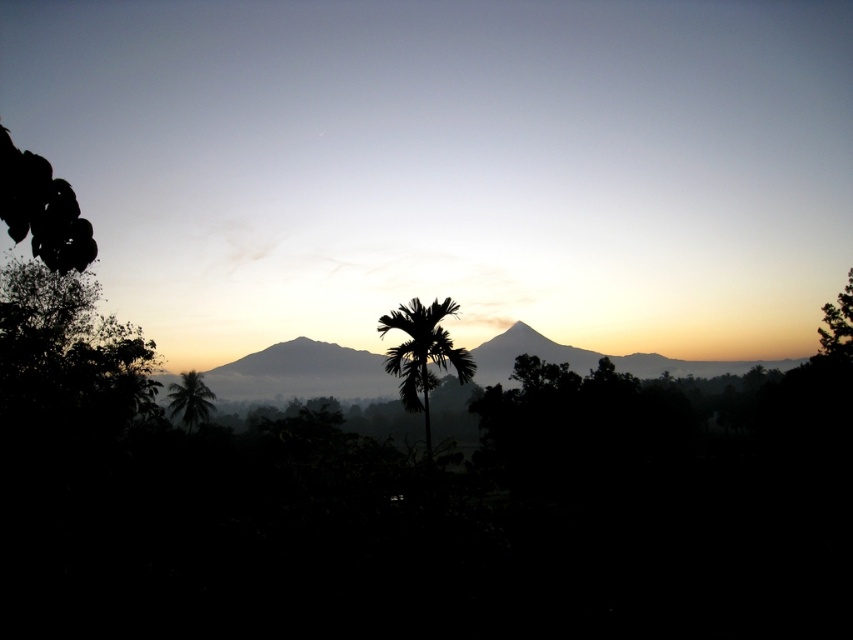
Question: Can you confirm if green leafy tree at left is thinner than green leafy palm tree at lower left?

Choices:
 (A) yes
 (B) no

Answer: (B)

Question: Which object appears farthest from the camera in this image?

Choices:
 (A) silvery misty mountain at center
 (B) green leafy palm at center

Answer: (A)

Question: Can you confirm if green leafy tree at left is wider than silvery misty mountain at center?

Choices:
 (A) no
 (B) yes

Answer: (A)

Question: Which object is closer to the camera taking this photo?

Choices:
 (A) green leafy tree at left
 (B) silvery misty mountain at center
 (C) green leafy tree at right

Answer: (A)

Question: Which object is farther from the camera taking this photo?

Choices:
 (A) green leafy tree at right
 (B) green leafy palm at center
 (C) green leafy tree at left
 (D) green leafy palm tree at lower left

Answer: (D)

Question: Where is green leafy tree at left located in relation to green leafy palm at center in the image?

Choices:
 (A) left
 (B) right

Answer: (A)